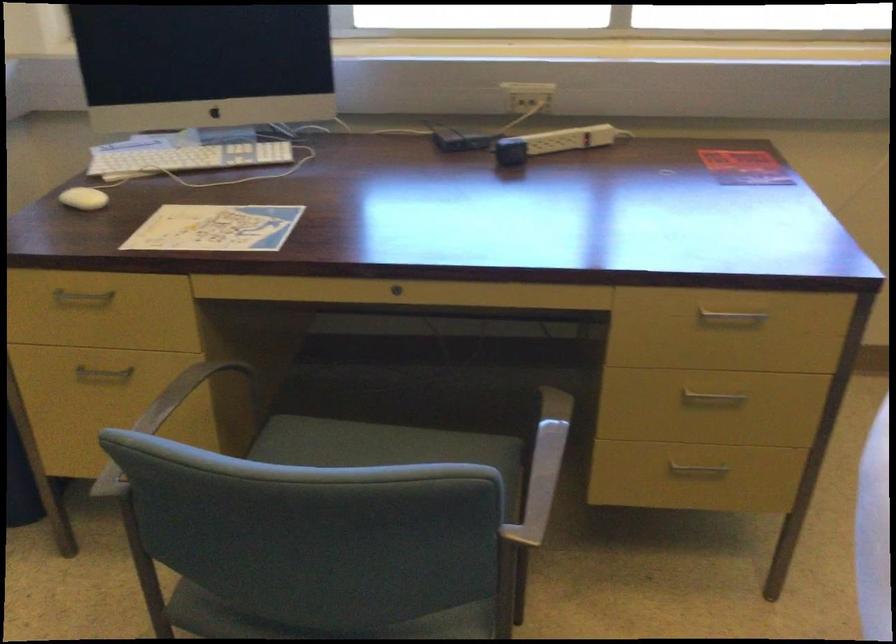
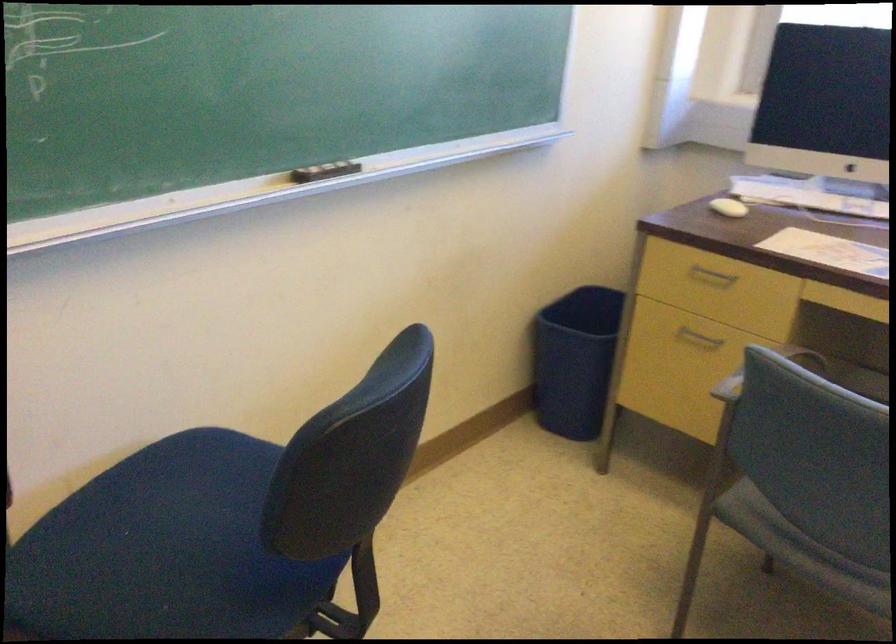
Question: The images are taken continuously from a first-person perspective. In which direction is your viewpoint rotating?

Choices:
 (A) Left
 (B) Right
 (C) Up
 (D) Down

Answer: (A)